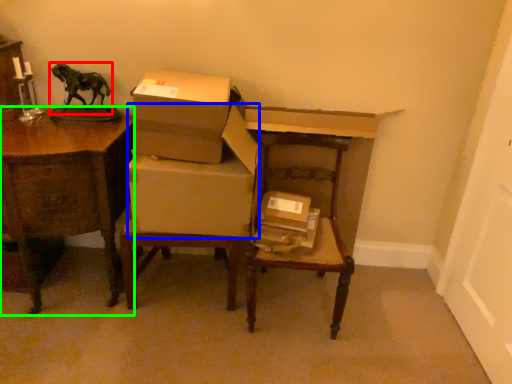
Question: Based on their relative distances, which object is nearer to animal (highlighted by a red box)? Choose from cardboard box (highlighted by a blue box) and desk (highlighted by a green box).

Choices:
 (A) cardboard box
 (B) desk

Answer: (B)